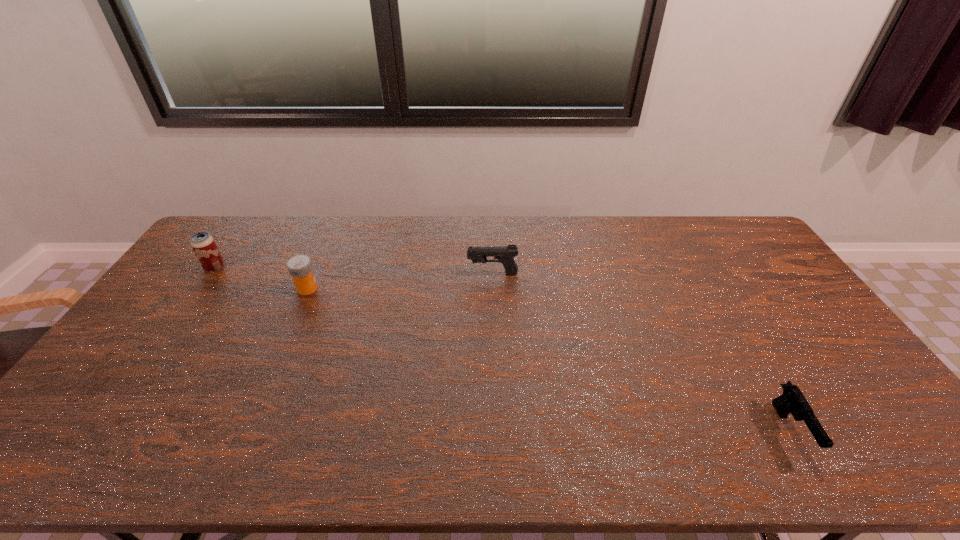
Where is `beer can`? This screenshot has width=960, height=540. beer can is located at coordinates (203, 245).

Locate an element on the screen. Image resolution: width=960 pixels, height=540 pixels. the left pistol is located at coordinates (505, 254).

The image size is (960, 540). What are the coordinates of `the second object from right to left` in the screenshot? It's located at (505, 254).

The width and height of the screenshot is (960, 540). In order to click on the third object from right to left in this screenshot , I will do `click(300, 267)`.

Identify the location of medicine. (300, 267).

Image resolution: width=960 pixels, height=540 pixels. What are the coordinates of `the right pistol` in the screenshot? It's located at (792, 400).

Identify the location of the nearest object. (792, 400).

Where is `vacant space located on the front of the leftmost object`? vacant space located on the front of the leftmost object is located at coordinates (158, 347).

Identify the location of vacant point located at the barrel of the farther pistol. (405, 274).

Where is `vacant position located at the barrel of the farther pistol`? vacant position located at the barrel of the farther pistol is located at coordinates (435, 274).